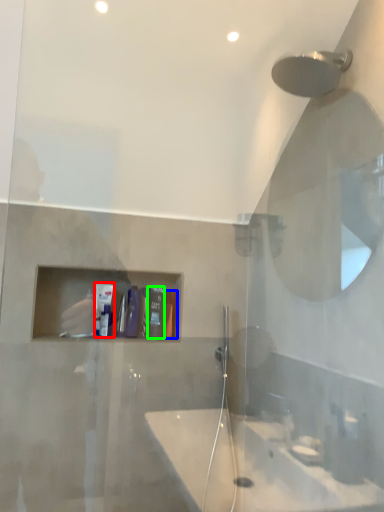
Question: Considering the real-world distances, which object is farthest from toiletry (highlighted by a red box)? toiletry (highlighted by a blue box) or toiletry (highlighted by a green box)?

Choices:
 (A) toiletry
 (B) toiletry

Answer: (A)